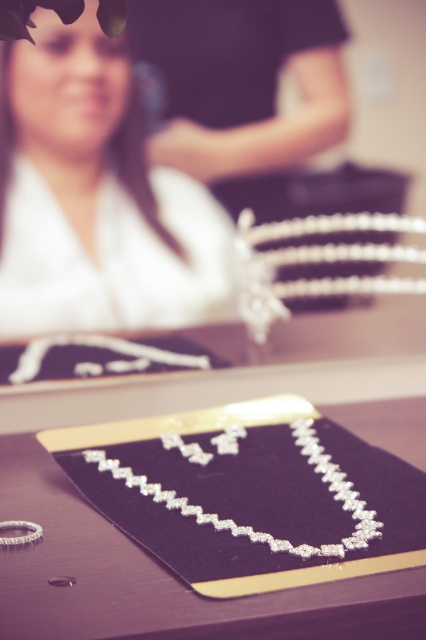
Is point (77, 612) closer to camera compared to point (204, 461)?

Yes, point (77, 612) is closer to viewer.

Does matte black jewelry at center appear on the right side of clear crystal necklace at center?

Incorrect, matte black jewelry at center is not on the right side of clear crystal necklace at center.

Does point (14, 451) come in front of point (356, 532)?

No, (14, 451) is behind (356, 532).

The height and width of the screenshot is (640, 426). I want to click on matte black jewelry at center, so pyautogui.click(x=157, y=579).

From the picture: Who is shorter, white satin robe at upper left or matte black jewelry at center?

With less height is matte black jewelry at center.

Which of these two, white satin robe at upper left or matte black jewelry at center, stands taller?

Standing taller between the two is white satin robe at upper left.

In order to click on white satin robe at upper left in this screenshot , I will do `click(98, 198)`.

Identify the location of white satin robe at upper left. Image resolution: width=426 pixels, height=640 pixels. (98, 198).

Does white satin robe at upper left appear under clear crystal necklace at center?

No, white satin robe at upper left is not below clear crystal necklace at center.

Based on the photo, who is higher up, white satin robe at upper left or clear crystal necklace at center?

Positioned higher is white satin robe at upper left.

Which is in front, point (45, 186) or point (304, 417)?

Point (304, 417)

You are a GUI agent. You are given a task and a screenshot of the screen. Output one action in this format:
    pyautogui.click(x=<x>, y=<y>)
    Task: Click on the white satin robe at upper left
    This screenshot has width=426, height=640.
    Given the screenshot: What is the action you would take?
    pyautogui.click(x=98, y=198)